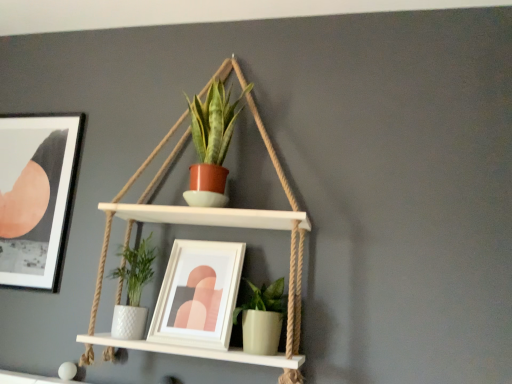
Question: From the image's perspective, is matte terracotta pot at center, the 1th houseplant in the top-to-bottom sequence, located above or below green matte pot at lower center, the second houseplant viewed from the top?

Choices:
 (A) above
 (B) below

Answer: (A)

Question: Is matte terracotta pot at center, placed as the 2th houseplant when sorted from bottom to top, taller or shorter than green matte pot at lower center, which ranks as the 1th houseplant in bottom-to-top order?

Choices:
 (A) tall
 (B) short

Answer: (A)

Question: Which is farther from the matte terracotta pot at center, placed as the 2th houseplant when sorted from bottom to top?

Choices:
 (A) green matte pot at lower center, the second houseplant viewed from the top
 (B) matte black picture frame at upper left, which is the 2th picture frame in right-to-left order
 (C) white matte picture frame at center, which is counted as the 1th picture frame, starting from the front

Answer: (B)

Question: Based on their relative distances, which object is nearer to the white matte picture frame at center, marked as the second picture frame in a back-to-front arrangement?

Choices:
 (A) matte black picture frame at upper left, placed as the second picture frame when sorted from front to back
 (B) green matte pot at lower center, which ranks as the 1th houseplant in bottom-to-top order
 (C) matte terracotta pot at center, the 1th houseplant in the top-to-bottom sequence

Answer: (B)